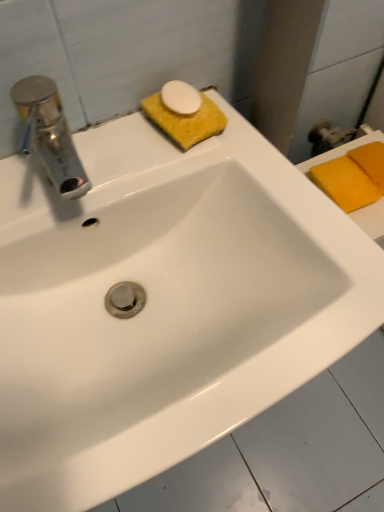
Identify the location of vacant space to the right of yellow sponge at upper center, the 3th soap viewed from the right. (251, 136).